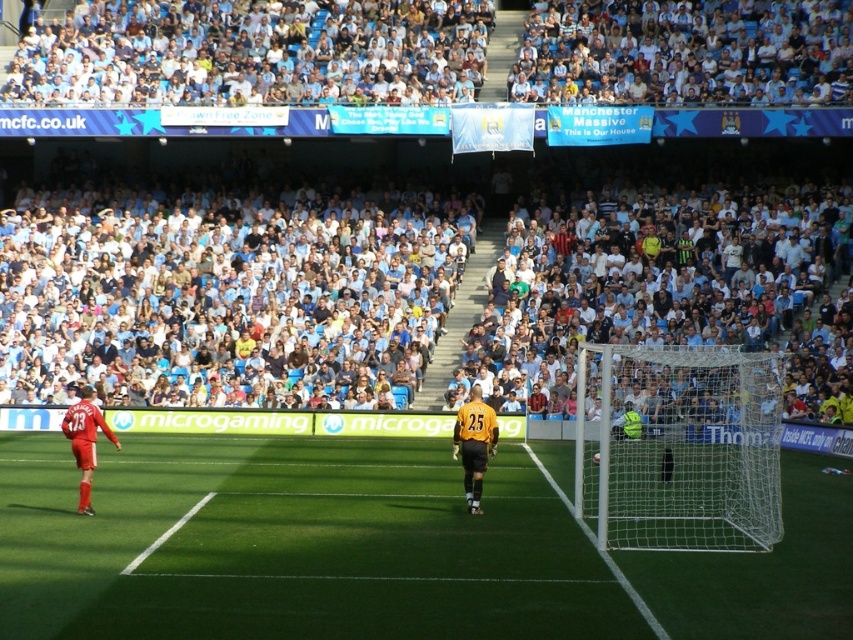
Question: Is yellow jersey at center positioned behind red jersey at left?

Choices:
 (A) yes
 (B) no

Answer: (A)

Question: Which object is positioned closest to the white fabric crowd at upper center?

Choices:
 (A) green artificial turf at center
 (B) red jersey at left
 (C) white mesh net at right

Answer: (C)

Question: Is white mesh net at right smaller than yellow jersey at center?

Choices:
 (A) no
 (B) yes

Answer: (A)

Question: Is white mesh net at right bigger than red jersey at left?

Choices:
 (A) yes
 (B) no

Answer: (A)

Question: Among these points, which one is nearest to the camera?

Choices:
 (A) click(x=473, y=452)
 (B) click(x=70, y=429)
 (C) click(x=688, y=384)

Answer: (B)

Question: Which point is farther from the camera taking this photo?

Choices:
 (A) (830, 602)
 (B) (78, 509)
 (C) (654, 525)

Answer: (B)